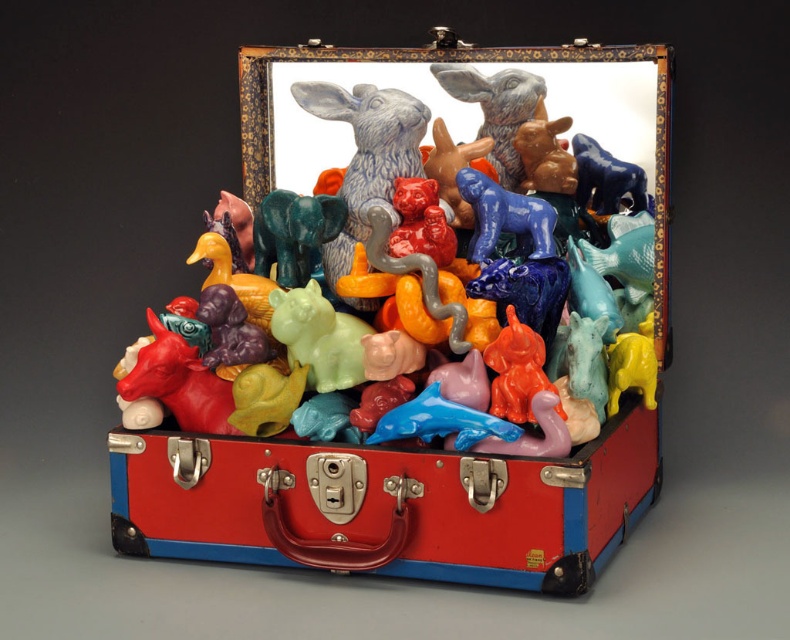
You are packing a gift for a friend and want to ensure the blue glossy dog at center and the blue glossy horse at upper center fit into a small gift box. Based on their sizes, which figurine might not fit if the box is designed for smaller items?

The blue glossy dog at center has a larger size compared to the blue glossy horse at upper center, so it might not fit into the small gift box designed for smaller items.

You are standing in front of the vintage suitcase and want to place a new figurine. If you want to place it in front of both point (x=390, y=108) and point (x=593, y=184), where should you place it?

You should place the new figurine in front of point (x=390, y=108) because it is closer to you than point (x=593, y=184).